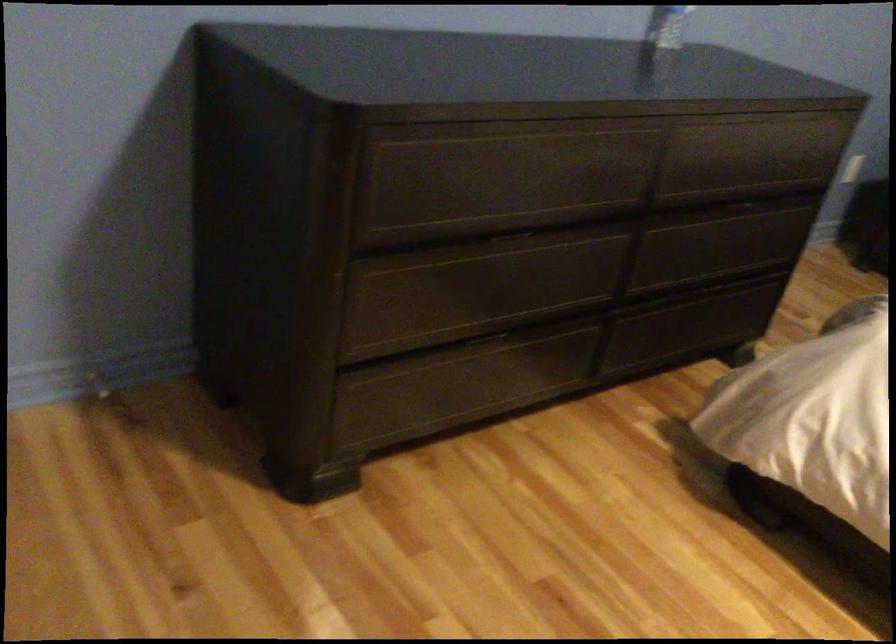
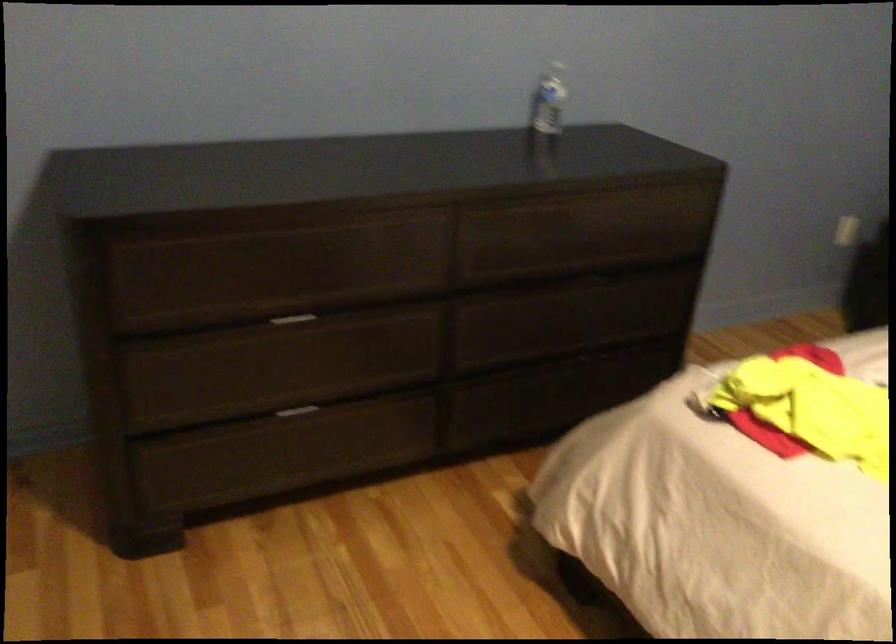
Find the pixel in the second image that matches (x=484, y=339) in the first image.

(297, 411)